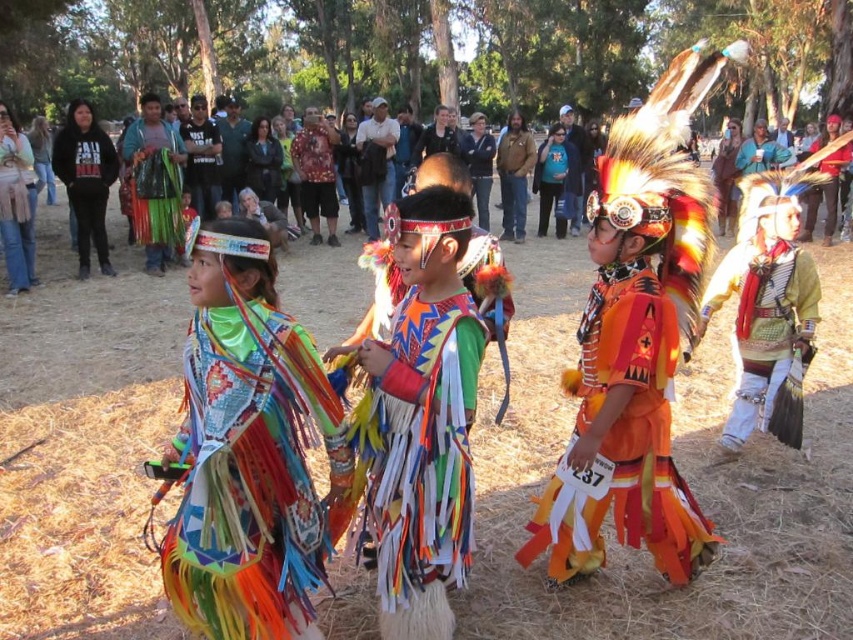
Does multicolored feathers at center have a larger size compared to black hoodie at left?

Indeed, multicolored feathers at center has a larger size compared to black hoodie at left.

What do you see at coordinates (96, 294) in the screenshot? I see `multicolored feathers at center` at bounding box center [96, 294].

Where is `multicolored feathers at center`? Image resolution: width=853 pixels, height=640 pixels. multicolored feathers at center is located at coordinates (96, 294).

Does orange fabric headdress at center appear on the right side of yellow-green fabric headdress at right?

In fact, orange fabric headdress at center is to the left of yellow-green fabric headdress at right.

Who is higher up, orange fabric headdress at center or yellow-green fabric headdress at right?

yellow-green fabric headdress at right

Which is in front, point (689, 552) or point (767, 294)?

Point (689, 552)

Where is `orange fabric headdress at center`? This screenshot has height=640, width=853. orange fabric headdress at center is located at coordinates (621, 438).

Is multicolored fringed vest at center behind black hoodie at left?

No, it is in front of black hoodie at left.

Can you confirm if multicolored fringed vest at center is thinner than black hoodie at left?

Incorrect, multicolored fringed vest at center's width is not less than black hoodie at left's.

Which is behind, point (228, 486) or point (88, 160)?

Positioned behind is point (88, 160).

Where is `multicolored fringed vest at center`? Image resolution: width=853 pixels, height=640 pixels. multicolored fringed vest at center is located at coordinates (252, 476).